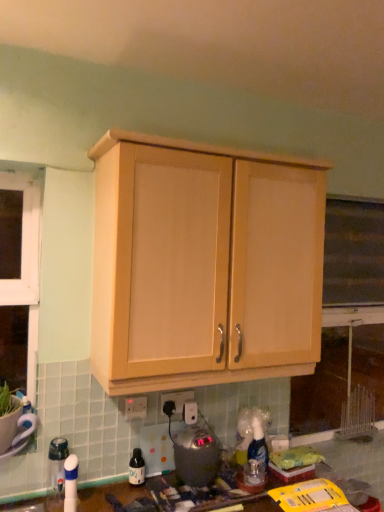
Question: Is white plastic electric outlet at center, placed as the 2th electric outlet when sorted from left to right, thinner than white plastic electric outlet at lower center, which appears as the first electric outlet when viewed from the front?

Choices:
 (A) no
 (B) yes

Answer: (A)

Question: Is white plastic electric outlet at center, placed as the 2th electric outlet when sorted from front to back, to the left of white plastic electric outlet at lower center, which is the second electric outlet from back to front, from the viewer's perspective?

Choices:
 (A) no
 (B) yes

Answer: (A)

Question: Is white plastic electric outlet at center, the 1th electric outlet from the back, beside white plastic electric outlet at lower center, arranged as the first electric outlet when viewed from the left?

Choices:
 (A) yes
 (B) no

Answer: (B)

Question: Is white plastic electric outlet at lower center, the second electric outlet viewed from the right, inside white plastic electric outlet at center, the 1th electric outlet from the back?

Choices:
 (A) yes
 (B) no

Answer: (B)

Question: From a real-world perspective, is white plastic electric outlet at center, the 1th electric outlet when ordered from right to left, on top of white plastic electric outlet at lower center, which is the second electric outlet from back to front?

Choices:
 (A) no
 (B) yes

Answer: (B)

Question: From their relative heights in the image, would you say white plastic electric outlet at center, the 1th electric outlet when ordered from right to left, is taller or shorter than light wood cabinet at upper center?

Choices:
 (A) short
 (B) tall

Answer: (A)

Question: In terms of width, does white plastic electric outlet at center, placed as the 2th electric outlet when sorted from front to back, look wider or thinner when compared to light wood cabinet at upper center?

Choices:
 (A) wide
 (B) thin

Answer: (B)

Question: Is point (163, 394) positioned closer to the camera than point (208, 180)?

Choices:
 (A) farther
 (B) closer

Answer: (A)

Question: From a real-world perspective, relative to light wood cabinet at upper center, is white plastic electric outlet at center, placed as the 2th electric outlet when sorted from front to back, vertically above or below?

Choices:
 (A) below
 (B) above

Answer: (A)

Question: Based on their sizes in the image, would you say white plastic electric outlet at center, placed as the 2th electric outlet when sorted from front to back, is bigger or smaller than white plastic electric outlet at lower center, arranged as the first electric outlet when viewed from the left?

Choices:
 (A) small
 (B) big

Answer: (B)

Question: From a real-world perspective, relative to white plastic electric outlet at lower center, which appears as the first electric outlet when viewed from the front, is white plastic electric outlet at center, placed as the 2th electric outlet when sorted from front to back, vertically above or below?

Choices:
 (A) below
 (B) above

Answer: (B)

Question: From the image's perspective, is white plastic electric outlet at center, placed as the 2th electric outlet when sorted from front to back, positioned above or below white plastic electric outlet at lower center, which is the second electric outlet from back to front?

Choices:
 (A) below
 (B) above

Answer: (A)

Question: Relative to white plastic electric outlet at lower center, arranged as the first electric outlet when viewed from the left, is white plastic electric outlet at center, placed as the 2th electric outlet when sorted from front to back, in front or behind?

Choices:
 (A) behind
 (B) front

Answer: (A)

Question: Considering the positions of translucent plastic bottle at lower center and satin silver appliance at lower center in the image, is translucent plastic bottle at lower center wider or thinner than satin silver appliance at lower center?

Choices:
 (A) thin
 (B) wide

Answer: (A)

Question: From the image's perspective, is translucent plastic bottle at lower center above or below satin silver appliance at lower center?

Choices:
 (A) below
 (B) above

Answer: (A)